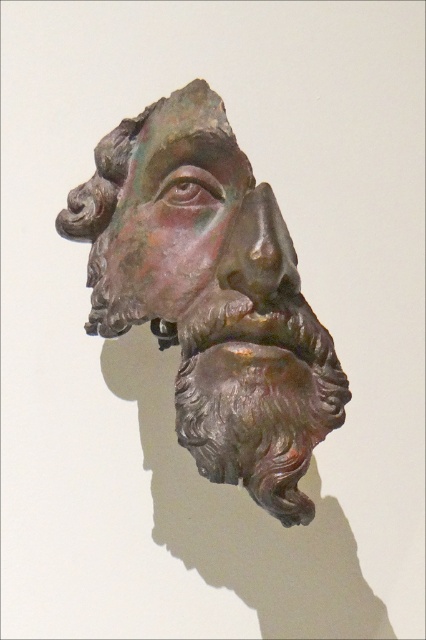
Question: From the image, what is the correct spatial relationship of bronze head at center in relation to rusty bronze face at center?

Choices:
 (A) below
 (B) above

Answer: (A)

Question: Can you confirm if bronze head at center is bigger than rusty bronze face at center?

Choices:
 (A) no
 (B) yes

Answer: (B)

Question: Can you confirm if bronze head at center is positioned to the left of rusty bronze face at center?

Choices:
 (A) yes
 (B) no

Answer: (B)

Question: Which point appears farthest from the camera in this image?

Choices:
 (A) (120, 216)
 (B) (114, 224)

Answer: (B)

Question: Which point is closer to the camera?

Choices:
 (A) rusty bronze face at center
 (B) bronze head at center

Answer: (B)